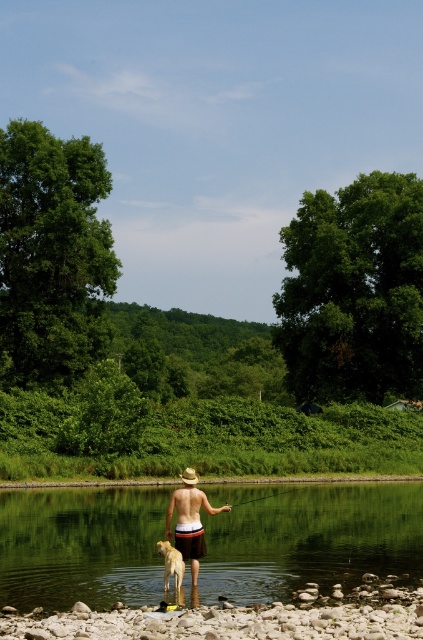
Is point (395, 508) behind point (194, 518)?

That is True.

Can you confirm if clear water at center is shorter than tan straw hat at center?

Yes, clear water at center is shorter than tan straw hat at center.

I want to click on clear water at center, so click(308, 538).

Does smooth sand shore at lower center have a lesser height compared to golden fur dog at lower center?

Indeed, smooth sand shore at lower center has a lesser height compared to golden fur dog at lower center.

Describe the element at coordinates (310, 477) in the screenshot. This screenshot has height=640, width=423. I see `smooth sand shore at lower center` at that location.

Is point (315, 480) in front of point (178, 552)?

No, it is behind (178, 552).

Find the location of a particular element. smooth sand shore at lower center is located at coordinates (310, 477).

Who is taller, clear water at center or golden fur dog at lower center?

With more height is clear water at center.

Does clear water at center appear over golden fur dog at lower center?

No.

Who is more forward, (161, 557) or (170, 561)?

Point (170, 561)

At what (x,y) coordinates should I click in order to perform the action: click on clear water at center. Please return your answer as a coordinate pair (x, y). Image resolution: width=423 pixels, height=640 pixels. Looking at the image, I should click on (308, 538).